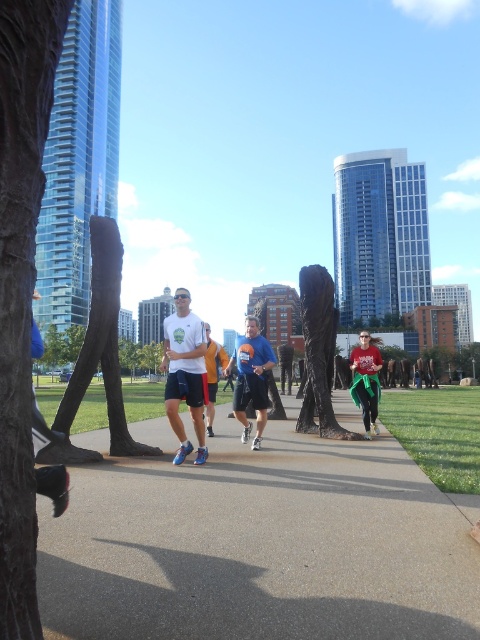
Describe the element at coordinates (184, 372) in the screenshot. I see `matte white t-shirt at center` at that location.

Where is `matte white t-shirt at center`? The image size is (480, 640). matte white t-shirt at center is located at coordinates (184, 372).

Where is `matte white t-shirt at center`? The height and width of the screenshot is (640, 480). matte white t-shirt at center is located at coordinates (184, 372).

Can you confirm if gray concrete sidewalk at center is smaller than matte green skirt at center?

Yes.

Between gray concrete sidewalk at center and matte green skirt at center, which one appears on the left side from the viewer's perspective?

From the viewer's perspective, gray concrete sidewalk at center appears more on the left side.

This screenshot has height=640, width=480. What do you see at coordinates (260, 545) in the screenshot? I see `gray concrete sidewalk at center` at bounding box center [260, 545].

Identify the location of gray concrete sidewalk at center. This screenshot has width=480, height=640. (260, 545).

Who is more forward, (156, 618) or (180, 392)?

Point (156, 618) is more forward.

Who is lower down, gray concrete sidewalk at center or matte white t-shirt at center?

gray concrete sidewalk at center is below.

Which is in front, point (312, 545) or point (166, 337)?

Point (312, 545) is more forward.

Locate an element on the screen. This screenshot has width=480, height=640. gray concrete sidewalk at center is located at coordinates (260, 545).